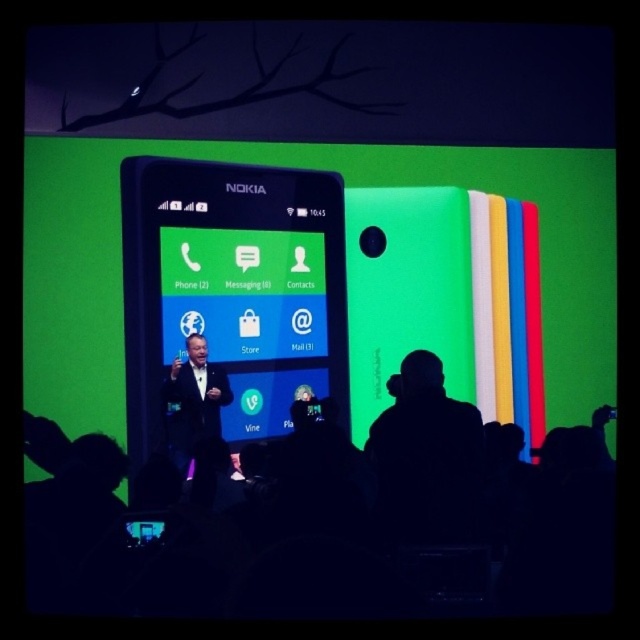
Question: Is black glossy phone at center wider than shiny black suit at center?

Choices:
 (A) yes
 (B) no

Answer: (A)

Question: Can you confirm if black glossy phone at center is positioned below shiny black suit at center?

Choices:
 (A) no
 (B) yes

Answer: (A)

Question: Is black glossy phone at center thinner than shiny black suit at center?

Choices:
 (A) yes
 (B) no

Answer: (B)

Question: Which object appears closest to the camera in this image?

Choices:
 (A) shiny black suit at center
 (B) black glossy phone at center

Answer: (B)